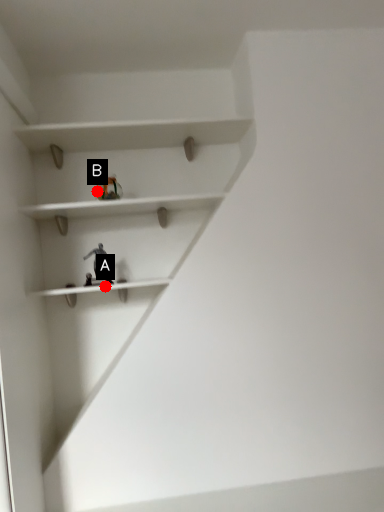
Question: Two points are circled on the image, labeled by A and B beside each circle. Among these points, which one is nearest to the camera?

Choices:
 (A) A is closer
 (B) B is closer

Answer: (B)